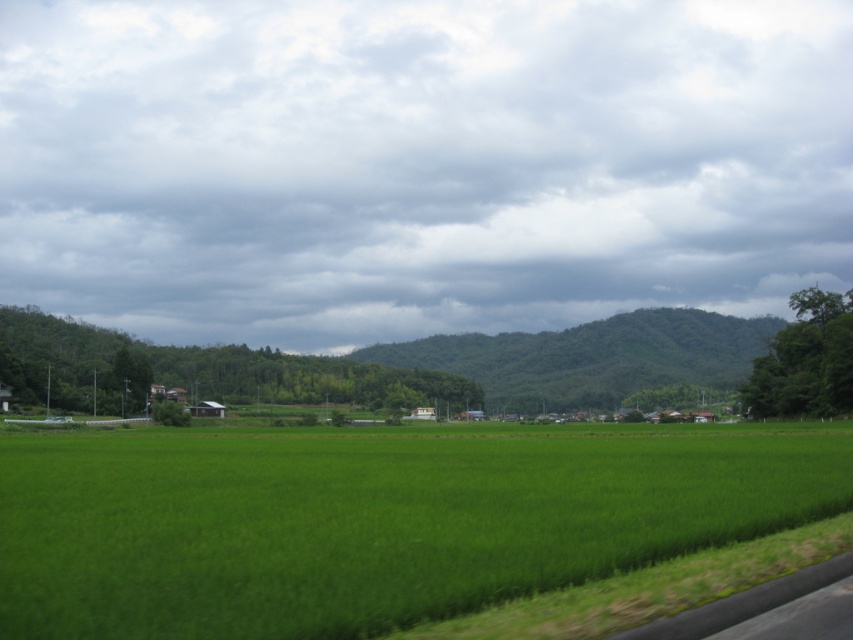
Question: Among these points, which one is nearest to the camera?

Choices:
 (A) click(x=767, y=342)
 (B) click(x=341, y=563)

Answer: (B)

Question: Which of the following is the farthest from the observer?

Choices:
 (A) green grass at center
 (B) green leafy mountain at center

Answer: (B)

Question: Is cloudy sky at upper center positioned at the back of green leafy mountain at center?

Choices:
 (A) no
 (B) yes

Answer: (B)

Question: Which point is farther from the camera taking this photo?

Choices:
 (A) (202, 472)
 (B) (579, 106)
 (C) (541, 336)

Answer: (B)

Question: Is cloudy sky at upper center smaller than green grass at center?

Choices:
 (A) yes
 (B) no

Answer: (B)

Question: Does green grass at center have a smaller size compared to green leafy mountain at center?

Choices:
 (A) yes
 (B) no

Answer: (A)